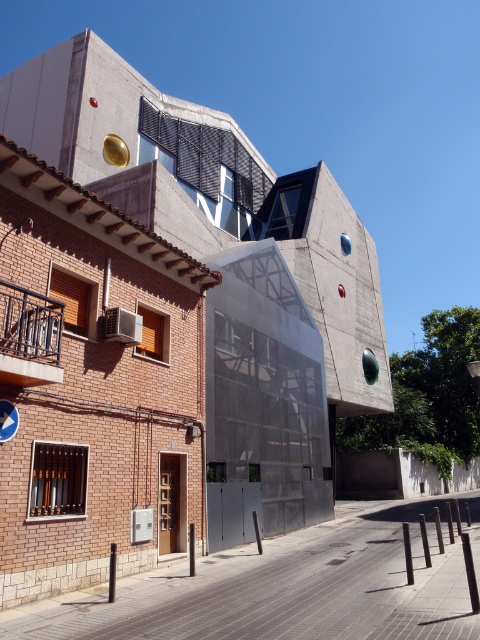
Question: Can you confirm if concrete building at center is bigger than blue plastic sign at center?

Choices:
 (A) no
 (B) yes

Answer: (B)

Question: Does concrete building at center appear on the left side of blue plastic sign at center?

Choices:
 (A) no
 (B) yes

Answer: (A)

Question: Which point appears farthest from the camera in this image?

Choices:
 (A) (130, 376)
 (B) (3, 406)

Answer: (A)

Question: Among these objects, which one is farthest from the camera?

Choices:
 (A) blue plastic sign at center
 (B) concrete building at center

Answer: (A)

Question: From the image, what is the correct spatial relationship of concrete building at center in relation to blue plastic sign at center?

Choices:
 (A) left
 (B) right

Answer: (B)

Question: Among these objects, which one is nearest to the camera?

Choices:
 (A) blue plastic sign at center
 (B) concrete building at center

Answer: (B)